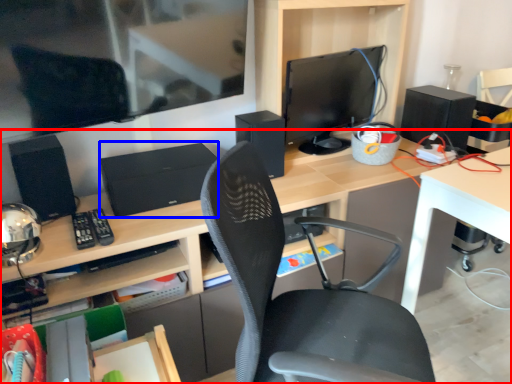
Question: Which point is closer to the camera, desk (highlighted by a red box) or computer (highlighted by a blue box)?

Choices:
 (A) desk
 (B) computer

Answer: (A)